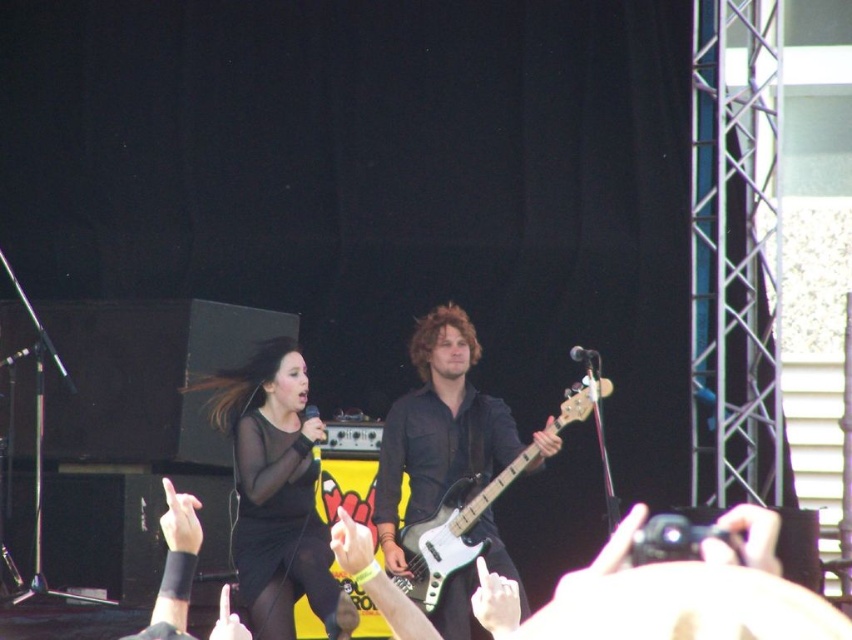
Describe the element at coordinates (277, 493) in the screenshot. The width and height of the screenshot is (852, 640). I see `black sheer dress at center` at that location.

Does black sheer dress at center have a smaller size compared to metallic silver bass guitar at center?

Incorrect, black sheer dress at center is not smaller in size than metallic silver bass guitar at center.

Measure the distance between point (265, 545) and camera.

Point (265, 545) and camera are 6.91 meters apart from each other.

Image resolution: width=852 pixels, height=640 pixels. What are the coordinates of `black sheer dress at center` in the screenshot? It's located at (277, 493).